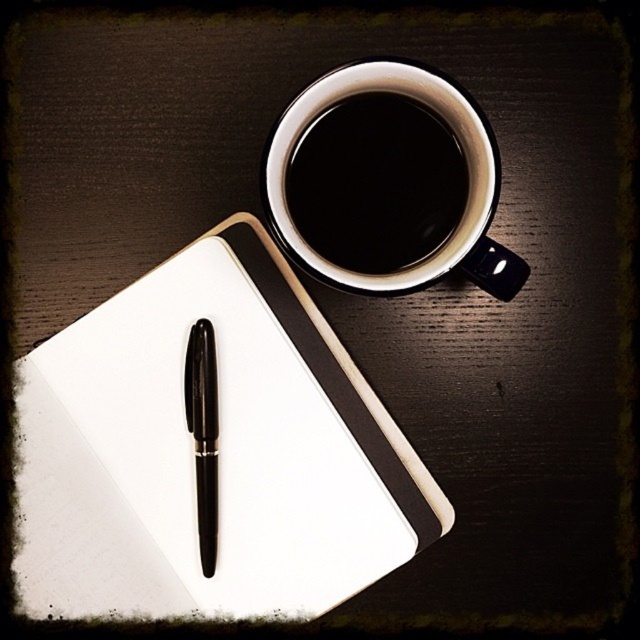
Question: Which point is farther to the camera?

Choices:
 (A) white matte notepad at upper left
 (B) black glossy mug at upper center
 (C) black ceramic mug at upper center

Answer: (A)

Question: In this image, where is white matte notepad at upper left located relative to black glossy pen at center?

Choices:
 (A) above
 (B) below

Answer: (A)

Question: Which of the following is the closest to the observer?

Choices:
 (A) (467, 246)
 (B) (189, 346)
 (C) (392, 269)
 (D) (403, 448)

Answer: (A)

Question: Which object is positioned farthest from the black glossy pen at center?

Choices:
 (A) black glossy mug at upper center
 (B) white matte notepad at upper left
 (C) black ceramic mug at upper center

Answer: (C)

Question: Does black ceramic mug at upper center have a greater width compared to black glossy pen at center?

Choices:
 (A) no
 (B) yes

Answer: (B)

Question: Is black ceramic mug at upper center below black glossy mug at upper center?

Choices:
 (A) no
 (B) yes

Answer: (B)